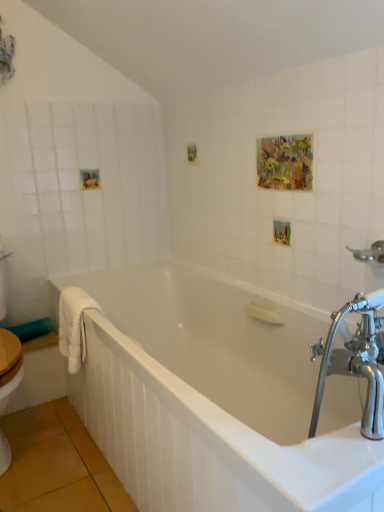
The width and height of the screenshot is (384, 512). Describe the element at coordinates (370, 252) in the screenshot. I see `chrome metallic showerhead at upper right` at that location.

In order to face white glossy bathtub at center, should I rotate leftwards or rightwards?

Rotate your view right by about 1.401°.

What is the approximate width of white fluffy towel at left?

white fluffy towel at left is 20.99 centimeters in width.

The width and height of the screenshot is (384, 512). What are the coordinates of `chrome metallic showerhead at upper right` in the screenshot? It's located at (370, 252).

What's the angular difference between chrome metallic showerhead at upper right and white glossy bathtub at center's facing directions?

The facing directions of chrome metallic showerhead at upper right and white glossy bathtub at center are 0.746 degrees apart.

Does point (373, 252) lie in front of point (169, 419)?

That is False.

Does chrome metallic showerhead at upper right appear on the right side of white glossy bathtub at center?

Yes, chrome metallic showerhead at upper right is to the right of white glossy bathtub at center.

Is chrome metallic showerhead at upper right oriented towards white glossy bathtub at center?

No, chrome metallic showerhead at upper right is not turned towards white glossy bathtub at center.

Is point (88, 321) closer to camera compared to point (374, 249)?

That is False.

At what (x,y) coordinates should I click in order to perform the action: click on bathtub below the chrome metallic showerhead at upper right (from the image's perspective). Please return your answer as a coordinate pair (x, y). Looking at the image, I should click on (215, 398).

Is white glossy bathtub at center at the right side of chrome metallic showerhead at upper right?

In fact, white glossy bathtub at center is to the left of chrome metallic showerhead at upper right.

Can you tell me how much white glossy bathtub at center and chrome metallic showerhead at upper right differ in facing direction?

0.746 degrees separate the facing orientations of white glossy bathtub at center and chrome metallic showerhead at upper right.

Does white fluffy towel at left turn towards white glossy bathtub at center?

Yes, white fluffy towel at left is aimed at white glossy bathtub at center.

Between white fluffy towel at left and white glossy bathtub at center, which one is positioned in front?

white glossy bathtub at center is in front.

Where is `bath towel on the left of white glossy bathtub at center`? The width and height of the screenshot is (384, 512). bath towel on the left of white glossy bathtub at center is located at coordinates (74, 325).

Which is closer, (76, 298) or (375, 255)?

The point (375, 255) is in front.

Can you tell me how much white fluffy towel at left and chrome metallic showerhead at upper right differ in facing direction?

The angular difference between white fluffy towel at left and chrome metallic showerhead at upper right is 4.06 degrees.

Visually, is white fluffy towel at left positioned to the left or to the right of chrome metallic showerhead at upper right?

Clearly, white fluffy towel at left is on the left of chrome metallic showerhead at upper right in the image.

Is chrome metallic showerhead at upper right directly adjacent to white fluffy towel at left?

No, chrome metallic showerhead at upper right is not next to white fluffy towel at left.

How far apart are chrome metallic showerhead at upper right and white fluffy towel at left?

chrome metallic showerhead at upper right is 1.05 meters from white fluffy towel at left.

Is chrome metallic showerhead at upper right further to camera compared to white fluffy towel at left?

No, it is not.

Considering the sizes of objects chrome metallic showerhead at upper right and white fluffy towel at left in the image provided, who is bigger, chrome metallic showerhead at upper right or white fluffy towel at left?

white fluffy towel at left.

From a real-world perspective, is white glossy bathtub at center over white fluffy towel at left?

No, from a real-world perspective, white glossy bathtub at center is not on top of white fluffy towel at left.

From the image's perspective, would you say white glossy bathtub at center is positioned over white fluffy towel at left?

No, from the image's perspective, white glossy bathtub at center is not on top of white fluffy towel at left.

Is point (266, 329) closer or farther from the camera than point (67, 330)?

Point (266, 329) is farther from the camera than point (67, 330).

Locate an element on the screen. The height and width of the screenshot is (512, 384). bathtub below the chrome metallic showerhead at upper right (from a real-world perspective) is located at coordinates (215, 398).

You are a GUI agent. You are given a task and a screenshot of the screen. Output one action in this format:
    pyautogui.click(x=<x>, y=<y>)
    Task: Click on the shower above the white glossy bathtub at center (from the image's perspective)
    
    Given the screenshot: What is the action you would take?
    pyautogui.click(x=370, y=252)

Looking at the image, which one is located further to white fluffy towel at left, chrome metallic showerhead at upper right or white glossy bathtub at center?

chrome metallic showerhead at upper right lies further to white fluffy towel at left than the other object.

Considering their positions, is chrome metallic showerhead at upper right positioned closer to white glossy bathtub at center than white fluffy towel at left?

white fluffy towel at left.

In the scene shown: When comparing their distances from chrome metallic showerhead at upper right, does white glossy bathtub at center or white fluffy towel at left seem closer?

Among the two, white glossy bathtub at center is located nearer to chrome metallic showerhead at upper right.

From the image, which object appears to be farther from white fluffy towel at left, white glossy bathtub at center or chrome metallic showerhead at upper right?

Among the two, chrome metallic showerhead at upper right is located further to white fluffy towel at left.

Looking at the image, which one is located further to white glossy bathtub at center, white fluffy towel at left or chrome metallic showerhead at upper right?

chrome metallic showerhead at upper right.

In the scene shown: Considering their positions, is white fluffy towel at left positioned further to chrome metallic showerhead at upper right than white glossy bathtub at center?

white fluffy towel at left is further to chrome metallic showerhead at upper right.

This screenshot has width=384, height=512. I want to click on bathtub situated between white fluffy towel at left and chrome metallic showerhead at upper right from left to right, so click(x=215, y=398).